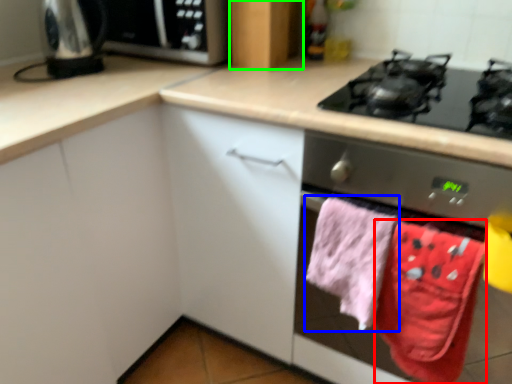
Question: Which object is the farthest from beach towel (highlighted by a red box)? Choose among these: beach towel (highlighted by a blue box) or cabinetry (highlighted by a green box).

Choices:
 (A) beach towel
 (B) cabinetry

Answer: (B)